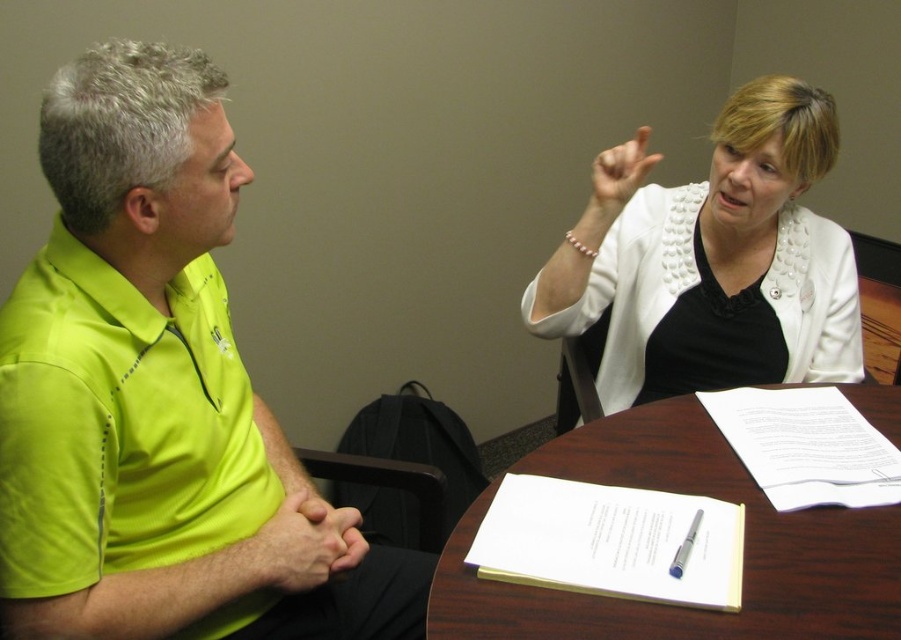
Based on the scene description, where is the neon yellow polyester polo shirt at left located in terms of its position relative to other objects in the image?

The neon yellow polyester polo shirt at left is located at the position with coordinates 0.664 on the x axis and 0.134 on the y axis.

You are standing in front of the table where the two people are sitting. There are two points marked on the table surface. The first point is at coordinates point (244, 624) and the second point is at point (777, 356). If you want to place a small object on the table such that it is closer to you, which point should you choose?

You should choose point (244, 624) because it is closer to the viewer than point (777, 356).